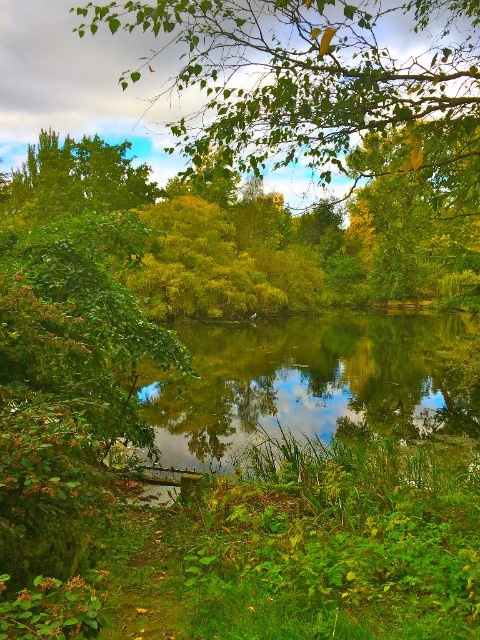
Is green leafy tree at upper center positioned in front of green reflective water at center?

Yes, it is.

Can you confirm if green leafy tree at upper center is positioned to the right of green reflective water at center?

In fact, green leafy tree at upper center is to the left of green reflective water at center.

Image resolution: width=480 pixels, height=640 pixels. Identify the location of green leafy tree at upper center. (312, 77).